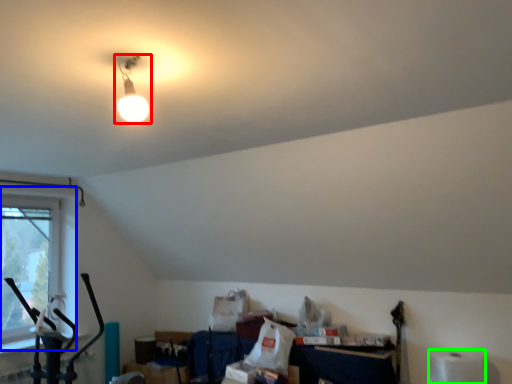
Question: Estimate the real-world distances between objects in this image. Which object is farther from lamp (highlighted by a red box), window (highlighted by a blue box) or toilet paper (highlighted by a green box)?

Choices:
 (A) window
 (B) toilet paper

Answer: (B)